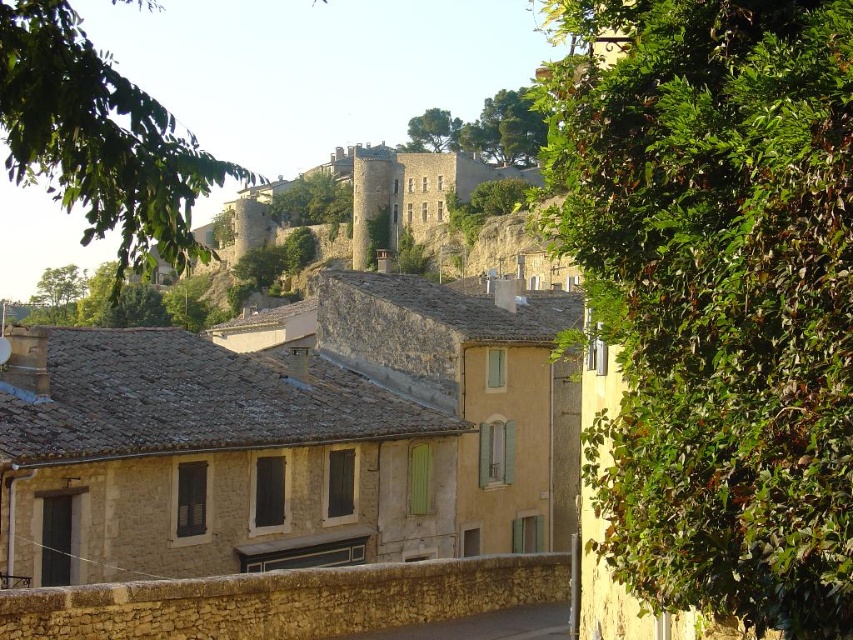
You are a tourist standing in front of the stone house at center and the gray stone alley at lower center. You want to take a photo that includes both objects in the frame. Which object should you move closer to in order to ensure both are fully visible?

To include both the stone house at center and the gray stone alley at lower center in the photo, you should move closer to the gray stone alley at lower center since it is smaller in size compared to the stone house at center, allowing both to fit within the frame.

You are standing at the edge of the village and want to take a photo of the stone house at center and the gray stone alley at lower center. Which one should you zoom in on more to ensure both fit in the frame?

You should zoom in more on the gray stone alley at lower center because the stone house at center is wider than the alley, so it will take up more space in the photo.